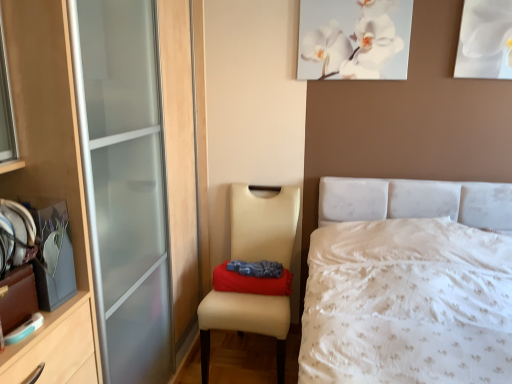
Question: From a real-world perspective, is white canvas at upper center, acting as the first picture frame starting from the left, located higher than red fabric pillow at center?

Choices:
 (A) yes
 (B) no

Answer: (A)

Question: From the image's perspective, would you say white canvas at upper center, which is the 2th picture frame from right to left, is shown under red fabric pillow at center?

Choices:
 (A) yes
 (B) no

Answer: (B)

Question: From the image's perspective, does white canvas at upper center, which is the 2th picture frame from right to left, appear higher than red fabric pillow at center?

Choices:
 (A) yes
 (B) no

Answer: (A)

Question: Does white canvas at upper center, which is the 2th picture frame from right to left, appear on the right side of red fabric pillow at center?

Choices:
 (A) no
 (B) yes

Answer: (B)

Question: Is white canvas at upper center, acting as the first picture frame starting from the left, next to red fabric pillow at center?

Choices:
 (A) yes
 (B) no

Answer: (B)

Question: Can you confirm if white paper at upper right, which appears as the second picture frame when viewed from the left, is bigger than white canvas at upper center, which is the 2th picture frame from right to left?

Choices:
 (A) yes
 (B) no

Answer: (B)

Question: From the image's perspective, is white paper at upper right, which appears as the second picture frame when viewed from the left, above white canvas at upper center, acting as the first picture frame starting from the left?

Choices:
 (A) no
 (B) yes

Answer: (A)

Question: Is white paper at upper right, positioned as the first picture frame in right-to-left order, completely or partially outside of white canvas at upper center, acting as the first picture frame starting from the left?

Choices:
 (A) no
 (B) yes

Answer: (B)

Question: Does white paper at upper right, which appears as the second picture frame when viewed from the left, appear on the left side of white canvas at upper center, which is the 2th picture frame from right to left?

Choices:
 (A) yes
 (B) no

Answer: (B)

Question: Can you confirm if white paper at upper right, positioned as the first picture frame in right-to-left order, is shorter than white canvas at upper center, acting as the first picture frame starting from the left?

Choices:
 (A) yes
 (B) no

Answer: (A)

Question: Is white paper at upper right, positioned as the first picture frame in right-to-left order, at the right side of white canvas at upper center, which is the 2th picture frame from right to left?

Choices:
 (A) yes
 (B) no

Answer: (A)

Question: Can you confirm if white textured bed at center is bigger than red fabric pillow at center?

Choices:
 (A) yes
 (B) no

Answer: (A)